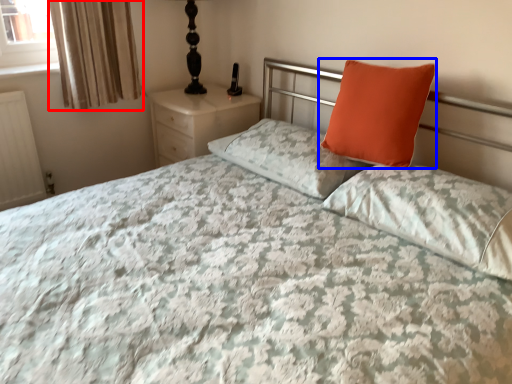
Question: Which point is further to the camera, curtain (highlighted by a red box) or pillow (highlighted by a blue box)?

Choices:
 (A) curtain
 (B) pillow

Answer: (A)